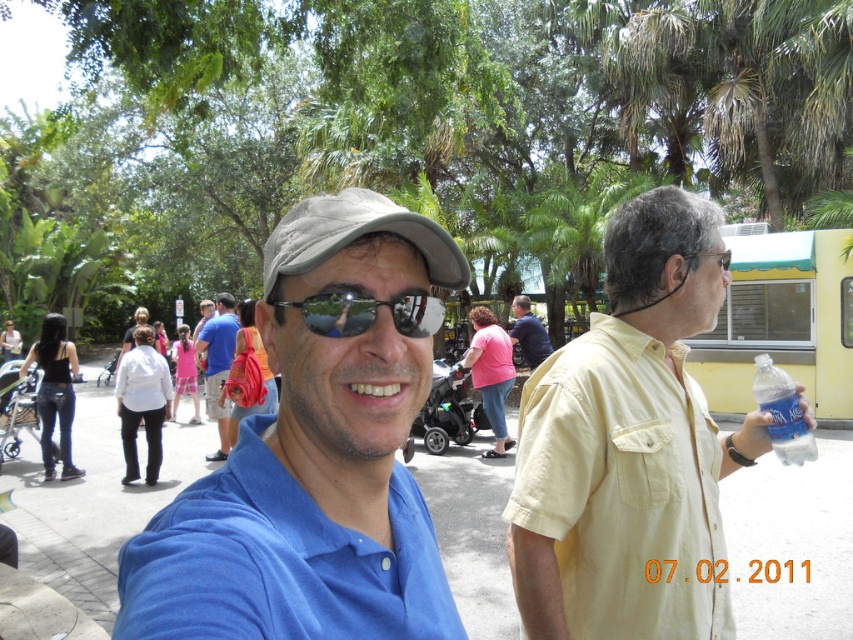
Based on the photo, does blue matte shirt at center appear on the right side of blue fabric shirt at center?

Correct, you'll find blue matte shirt at center to the right of blue fabric shirt at center.

Which of these two, blue matte shirt at center or blue fabric shirt at center, stands shorter?

Standing shorter between the two is blue matte shirt at center.

Does point (282, 493) come farther from viewer compared to point (207, 365)?

No, (282, 493) is closer to viewer.

Locate an element on the screen. blue matte shirt at center is located at coordinates (316, 452).

Is point (357, 630) positioned behind point (782, 378)?

No, (357, 630) is closer to viewer.

Is point (322, 268) positioned before point (779, 388)?

Yes, it is.

The image size is (853, 640). I want to click on blue matte shirt at center, so click(316, 452).

Does point (595, 508) come in front of point (535, 365)?

Yes, point (595, 508) is closer to viewer.

Measure the distance between yellow cotton shirt at right and matte blue shirt at center.

yellow cotton shirt at right is 7.09 meters away from matte blue shirt at center.

Which is behind, point (563, 497) or point (527, 333)?

Positioned behind is point (527, 333).

Locate an element on the screen. yellow cotton shirt at right is located at coordinates (630, 445).